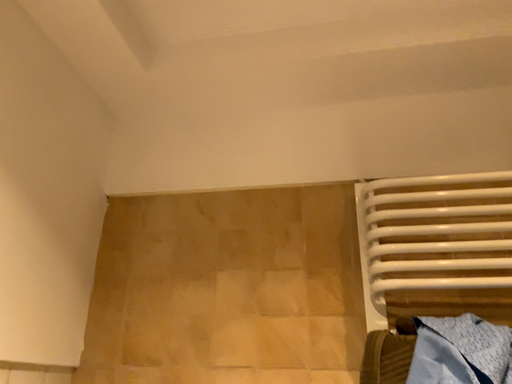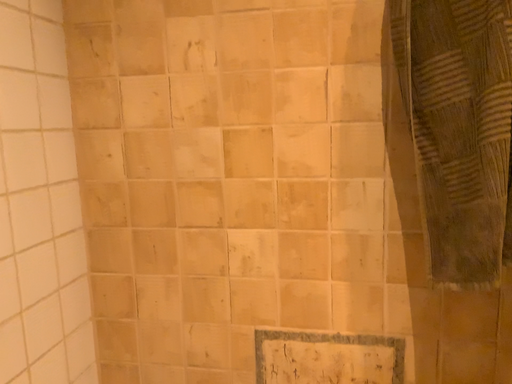
Question: Which way did the camera rotate in the video?

Choices:
 (A) rotated downward
 (B) rotated upward

Answer: (A)